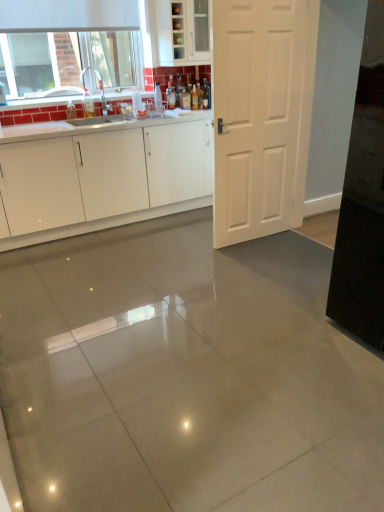
Question: Does white matte door at center lie in front of white glossy cabinetry at center, the first cabinetry positioned from the bottom?

Choices:
 (A) no
 (B) yes

Answer: (B)

Question: From the image's perspective, does white matte door at center appear higher than white glossy cabinetry at center, marked as the 2th cabinetry in a top-to-bottom arrangement?

Choices:
 (A) yes
 (B) no

Answer: (A)

Question: Can you confirm if white matte door at center is thinner than white glossy cabinetry at center, the first cabinetry positioned from the bottom?

Choices:
 (A) yes
 (B) no

Answer: (A)

Question: From the image's perspective, is white matte door at center located beneath white glossy cabinetry at center, marked as the 2th cabinetry in a top-to-bottom arrangement?

Choices:
 (A) no
 (B) yes

Answer: (A)

Question: Can you confirm if white matte door at center is smaller than white glossy cabinetry at center, marked as the 2th cabinetry in a top-to-bottom arrangement?

Choices:
 (A) no
 (B) yes

Answer: (B)

Question: Is white matte door at center surrounding white glossy cabinetry at center, marked as the 2th cabinetry in a top-to-bottom arrangement?

Choices:
 (A) yes
 (B) no

Answer: (B)

Question: Can you confirm if translucent glass bottle at center, placed as the 1th bottle when sorted from right to left, is smaller than white glossy cabinetry at center, marked as the 2th cabinetry in a top-to-bottom arrangement?

Choices:
 (A) yes
 (B) no

Answer: (A)

Question: Is translucent glass bottle at center, placed as the fourth bottle when sorted from left to right, oriented away from white glossy cabinetry at center, marked as the 2th cabinetry in a top-to-bottom arrangement?

Choices:
 (A) yes
 (B) no

Answer: (B)

Question: From a real-world perspective, is translucent glass bottle at center, placed as the 1th bottle when sorted from right to left, physically below white glossy cabinetry at center, the first cabinetry positioned from the bottom?

Choices:
 (A) yes
 (B) no

Answer: (B)

Question: Is translucent glass bottle at center, placed as the 1th bottle when sorted from right to left, at the right side of white glossy cabinetry at center, the first cabinetry positioned from the bottom?

Choices:
 (A) yes
 (B) no

Answer: (A)

Question: From the image's perspective, is translucent glass bottle at center, placed as the 1th bottle when sorted from right to left, located above white glossy cabinetry at center, the first cabinetry positioned from the bottom?

Choices:
 (A) yes
 (B) no

Answer: (A)

Question: Is translucent glass bottle at center, placed as the fourth bottle when sorted from left to right, outside of white glossy cabinetry at center, marked as the 2th cabinetry in a top-to-bottom arrangement?

Choices:
 (A) yes
 (B) no

Answer: (A)

Question: Is translucent amber bottle at upper center, positioned as the 2th bottle in right-to-left order, to the left of white matte door at center from the viewer's perspective?

Choices:
 (A) yes
 (B) no

Answer: (A)